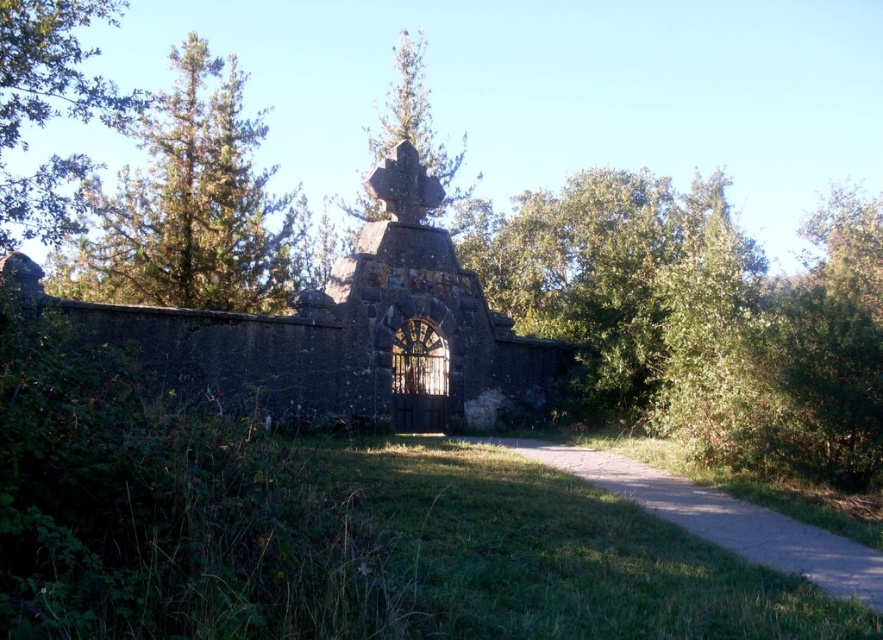
Does point (208, 332) come farther from viewer compared to point (21, 24)?

Yes, it is behind point (21, 24).

Between dark stone church at center and green leafy tree at upper left, which one has more height?

green leafy tree at upper left is taller.

Between point (342, 317) and point (26, 93), which one is positioned behind?

The point (342, 317) is behind.

You are a GUI agent. You are given a task and a screenshot of the screen. Output one action in this format:
    pyautogui.click(x=<x>, y=<y>)
    Task: Click on the dark stone church at center
    This screenshot has width=883, height=640.
    Given the screenshot: What is the action you would take?
    pyautogui.click(x=351, y=332)

Is green leafy tree at upper left to the right of gravel path at lower right from the viewer's perspective?

In fact, green leafy tree at upper left is to the left of gravel path at lower right.

Is green leafy tree at upper left to the left of gravel path at lower right from the viewer's perspective?

Yes, green leafy tree at upper left is to the left of gravel path at lower right.

This screenshot has width=883, height=640. What do you see at coordinates (50, 109) in the screenshot?
I see `green leafy tree at upper left` at bounding box center [50, 109].

Locate an element on the screen. The width and height of the screenshot is (883, 640). green leafy tree at upper left is located at coordinates (50, 109).

Is point (658, 202) positioned after point (48, 54)?

Yes, point (658, 202) is farther from viewer.

Can you confirm if green leafy tree at upper right is positioned to the right of green leafy tree at upper left?

Indeed, green leafy tree at upper right is positioned on the right side of green leafy tree at upper left.

This screenshot has width=883, height=640. What do you see at coordinates (595, 275) in the screenshot? I see `green leafy tree at upper right` at bounding box center [595, 275].

Where is `green leafy tree at upper right`? This screenshot has height=640, width=883. green leafy tree at upper right is located at coordinates (595, 275).